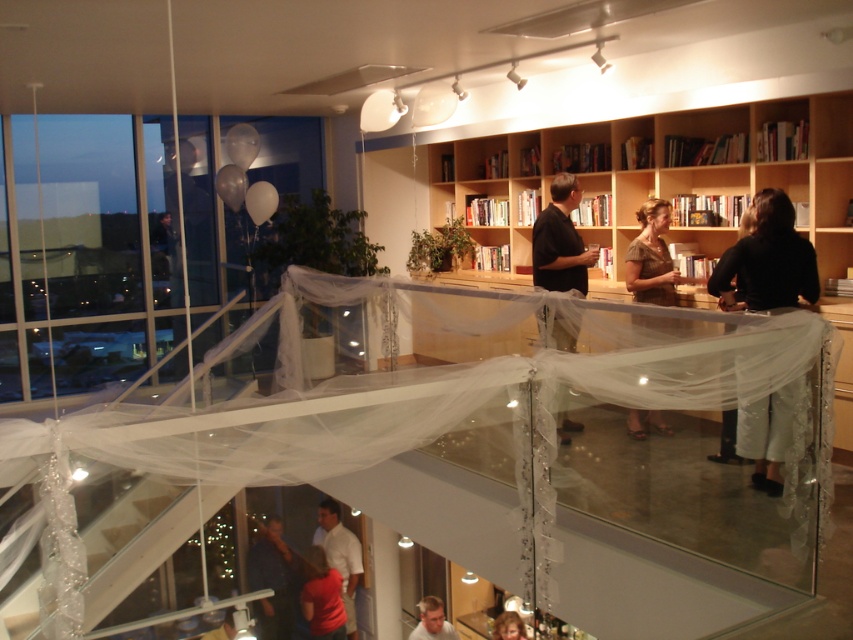
Is black matte shirt at center positioned behind matte red shirt at lower center?

No, black matte shirt at center is in front of matte red shirt at lower center.

Does black matte shirt at center appear on the right side of matte red shirt at lower center?

Correct, you'll find black matte shirt at center to the right of matte red shirt at lower center.

Locate an element on the screen. The height and width of the screenshot is (640, 853). black matte shirt at center is located at coordinates (560, 241).

Who is positioned more to the left, white matte shirt at lower center or light brown hair at lower center?

white matte shirt at lower center is more to the left.

Can you confirm if white matte shirt at lower center is smaller than light brown hair at lower center?

No, white matte shirt at lower center is not smaller than light brown hair at lower center.

Does point (344, 604) come behind point (418, 637)?

That is True.

Where is `white matte shirt at lower center`? white matte shirt at lower center is located at coordinates coord(340,556).

Can you confirm if dark blue shirt at lower center is taller than blonde hair at lower center?

Yes.

Does dark blue shirt at lower center have a greater width compared to blonde hair at lower center?

Correct, the width of dark blue shirt at lower center exceeds that of blonde hair at lower center.

Locate an element on the screen. This screenshot has width=853, height=640. dark blue shirt at lower center is located at coordinates (271, 580).